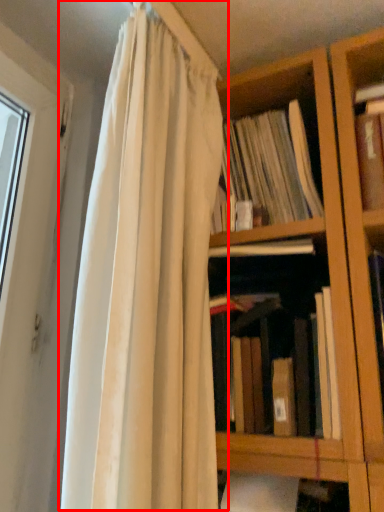
Question: From the image's perspective, where is curtain (annotated by the red box) located in relation to book in the image?

Choices:
 (A) below
 (B) above

Answer: (B)